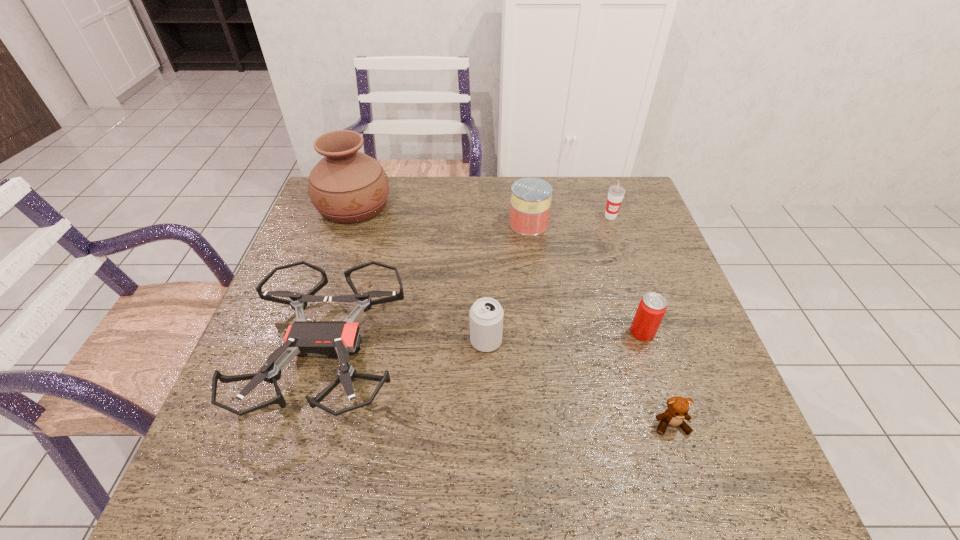
At what (x,y) coordinates should I click in order to perform the action: click on free point located 0.290m on the front of the farthest can. Please return your answer as a coordinate pair (x, y). This screenshot has height=540, width=960. Looking at the image, I should click on (540, 312).

What are the coordinates of `free point located on the back of the fifth object from right to left` in the screenshot? It's located at 486,309.

The image size is (960, 540). Identify the location of vacant space located 0.230m on the back of the rightmost can. (618, 258).

Find the location of a particular element. This screenshot has height=540, width=960. blank space located with the camera facing forward on the drone is located at coordinates (292, 462).

The width and height of the screenshot is (960, 540). What are the coordinates of `vacant space located 0.080m on the front-facing side of the teddy bear` in the screenshot? It's located at (688, 479).

Locate an element on the screen. urn that is at the far edge is located at coordinates (346, 186).

Where is `cup that is positioned at the far edge`? cup that is positioned at the far edge is located at coordinates (616, 193).

Where is `can that is at the far edge`? can that is at the far edge is located at coordinates (531, 197).

The width and height of the screenshot is (960, 540). Identify the location of urn positioned at the left edge. (346, 186).

At what (x,y) coordinates should I click in order to perform the action: click on drone at the left edge. Please return your answer as a coordinate pair (x, y). Image resolution: width=960 pixels, height=540 pixels. Looking at the image, I should click on (335, 339).